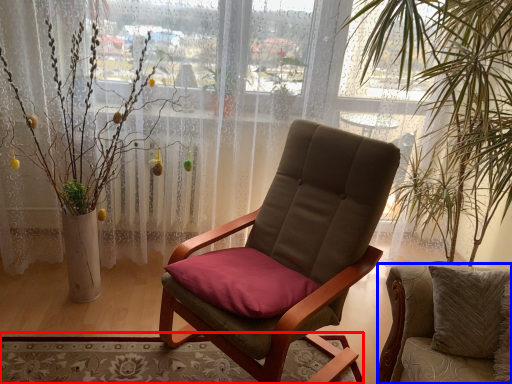
Question: Among these objects, which one is farthest to the camera, mat (highlighted by a red box) or chair (highlighted by a blue box)?

Choices:
 (A) mat
 (B) chair

Answer: (A)